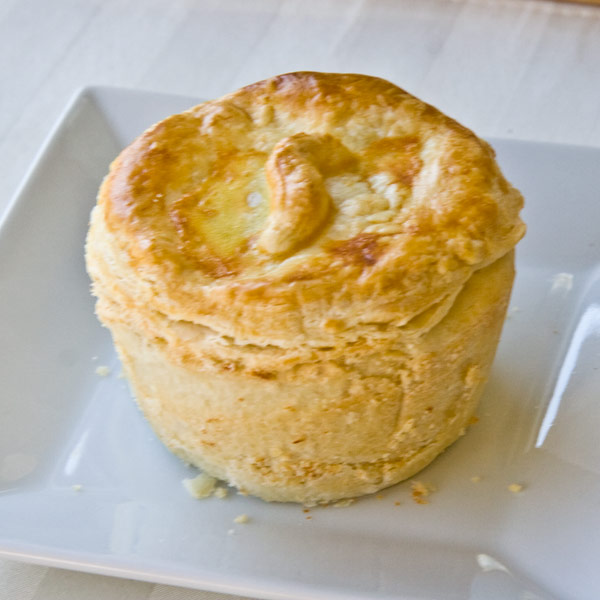
This screenshot has height=600, width=600. In order to click on bright highlight from an overhead light in this screenshot , I will do `click(70, 460)`, `click(31, 172)`, `click(559, 401)`, `click(586, 319)`, `click(491, 566)`.